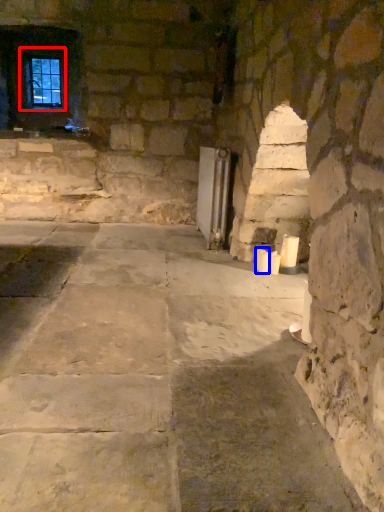
Question: Which object is further to the camera taking this photo, window (highlighted by a red box) or candle (highlighted by a blue box)?

Choices:
 (A) window
 (B) candle

Answer: (A)